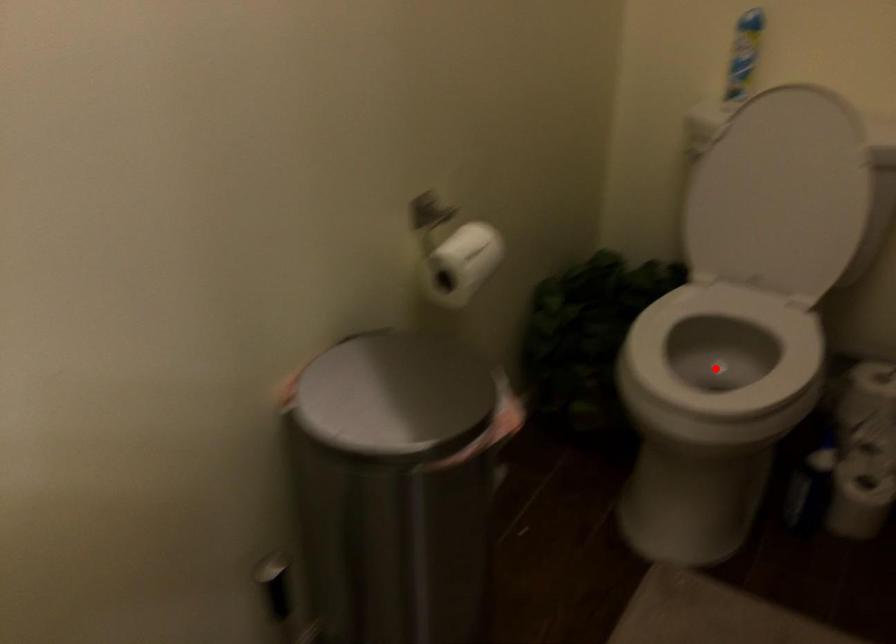
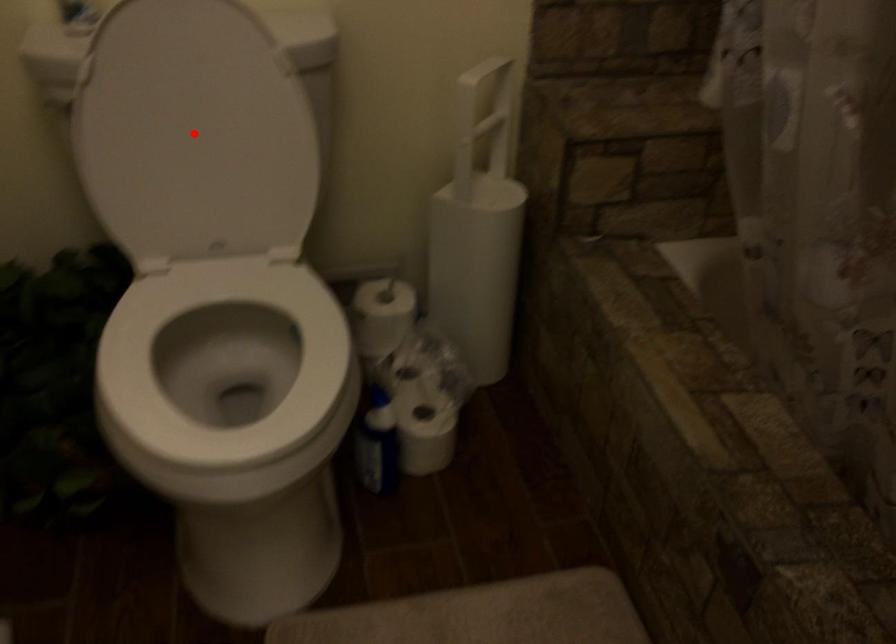
I am providing you with two images of the same scene from different viewpoints. A red point is marked on the first image and another point is marked on the second image. Are the points marked in image1 and image2 representing the same 3D position?

No